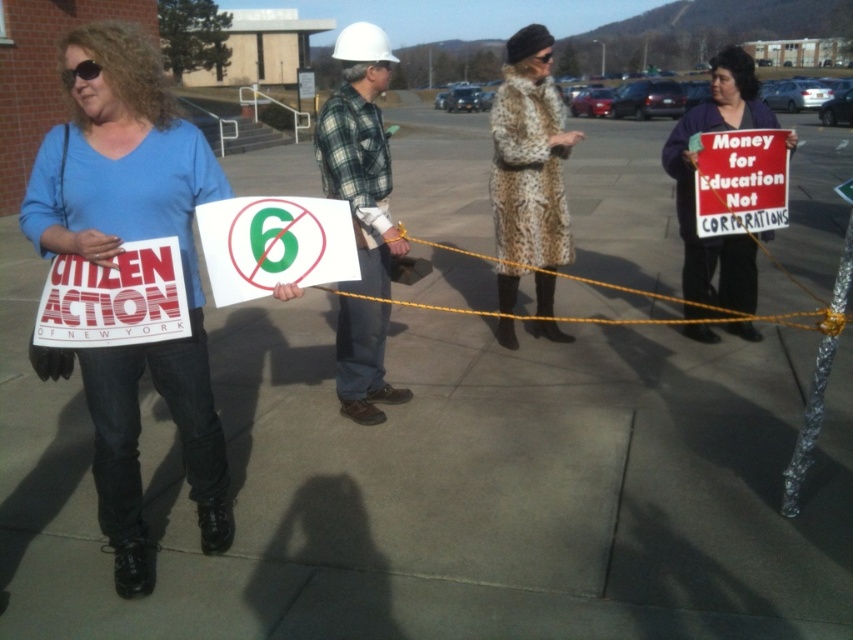
Does white paper sign at center appear on the right side of purple fabric coat at right?

In fact, white paper sign at center is to the left of purple fabric coat at right.

Between point (305, 214) and point (685, 125), which one is positioned in front?

Point (305, 214) is in front.

The width and height of the screenshot is (853, 640). In order to click on white paper sign at center in this screenshot , I will do `click(274, 244)`.

Who is lower down, white paper sign at center or white paper sign at left?

white paper sign at left is lower down.

Who is shorter, white paper sign at center or white paper sign at left?

white paper sign at left

This screenshot has height=640, width=853. I want to click on white paper sign at center, so click(274, 244).

Measure the distance between point (223, 300) and camera.

Point (223, 300) and camera are 7.82 feet apart.

How far apart are white paper sign at center and red cardboard sign at center?

The distance of white paper sign at center from red cardboard sign at center is 8.23 feet.

Find the location of a particular element. white paper sign at center is located at coordinates (274, 244).